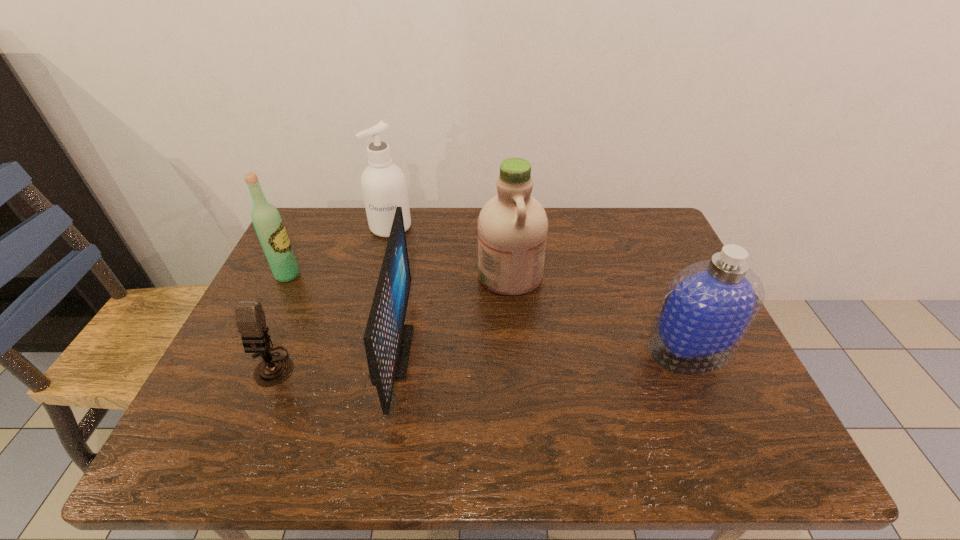
The width and height of the screenshot is (960, 540). Identify the location of the second farthest cleansing agent. (512, 226).

Where is `the second cleansing agent from right to left`? the second cleansing agent from right to left is located at coordinates (512, 226).

The width and height of the screenshot is (960, 540). Identify the location of the farthest cleansing agent. (383, 184).

Identify the location of the farthest object. (383, 184).

At what (x,y) coordinates should I click in order to perform the action: click on wine bottle. Please return your answer as a coordinate pair (x, y). The width and height of the screenshot is (960, 540). Looking at the image, I should click on (268, 224).

The width and height of the screenshot is (960, 540). Find the location of `the nearest cleansing agent`. the nearest cleansing agent is located at coordinates (708, 307).

This screenshot has height=540, width=960. Find the location of `the rightmost cleansing agent`. the rightmost cleansing agent is located at coordinates (708, 307).

I want to click on computer monitor, so click(x=387, y=340).

Locate an element on the screen. The image size is (960, 540). microphone is located at coordinates (250, 318).

The height and width of the screenshot is (540, 960). Find the location of `vacant area situated on the front label of the second cleansing agent from right to left`. vacant area situated on the front label of the second cleansing agent from right to left is located at coordinates (445, 275).